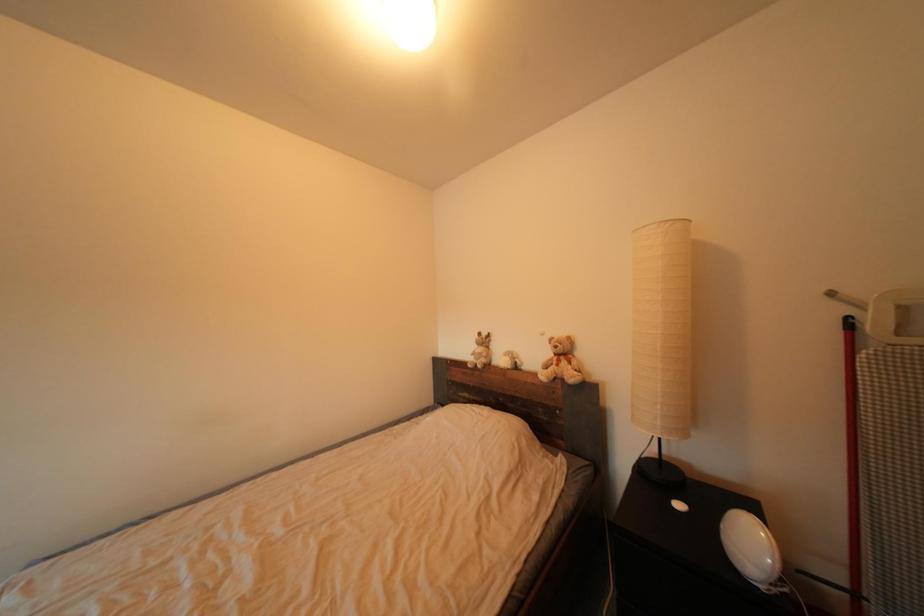
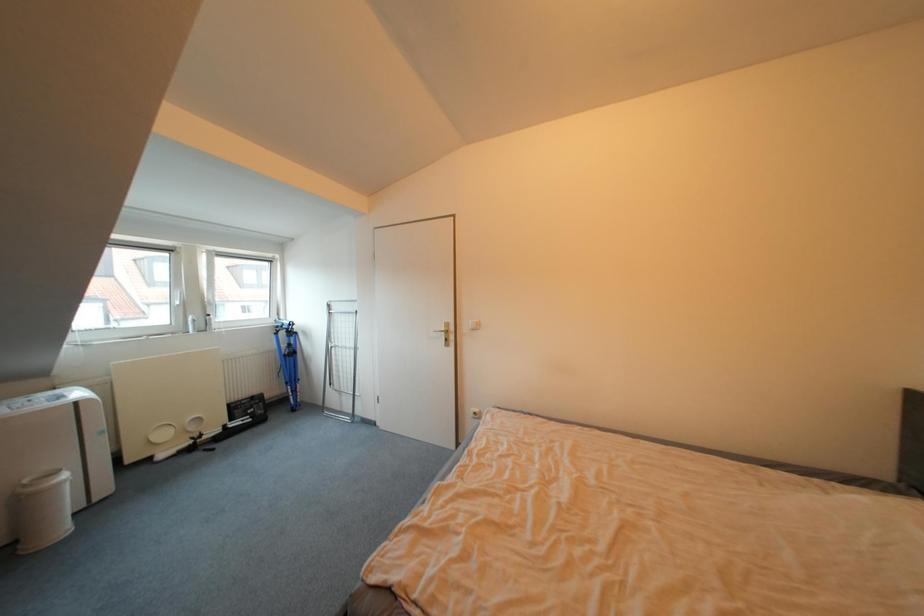
Question: The first image is from the beginning of the video and the second image is from the end. How did the camera likely rotate when shooting the video?

Choices:
 (A) Left
 (B) Right
 (C) Up
 (D) Down

Answer: (A)